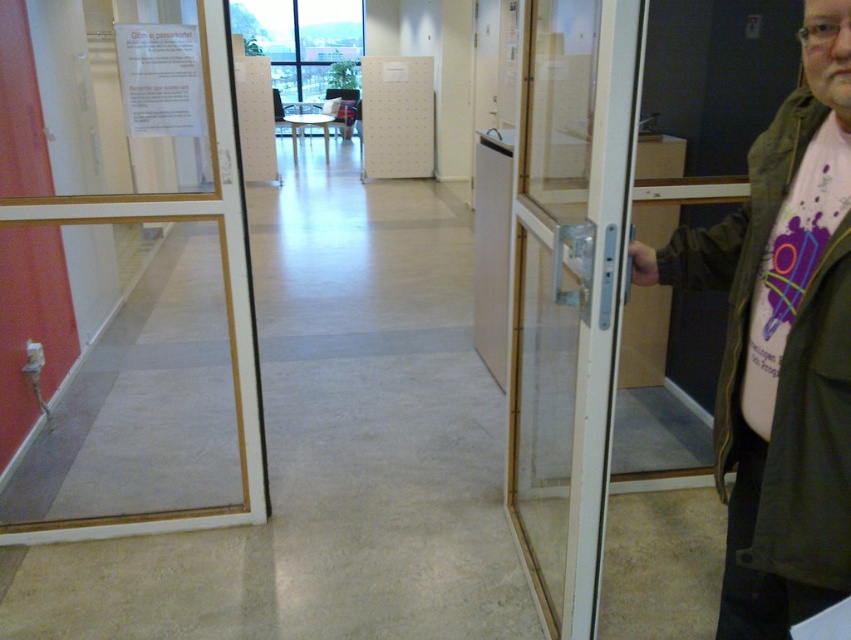
Question: Is green matte jacket at right above clear glass door at left?

Choices:
 (A) no
 (B) yes

Answer: (A)

Question: Is transparent glass door at right to the right of green matte jacket at right from the viewer's perspective?

Choices:
 (A) no
 (B) yes

Answer: (A)

Question: Does transparent glass door at right appear over clear glass door at left?

Choices:
 (A) no
 (B) yes

Answer: (B)

Question: Considering the real-world distances, which object is farthest from the transparent glass door at right?

Choices:
 (A) clear glass door at left
 (B) green matte jacket at right

Answer: (A)

Question: Which is nearer to the transparent glass door at right?

Choices:
 (A) clear glass door at left
 (B) green matte jacket at right

Answer: (B)

Question: Which point is farther to the camera?

Choices:
 (A) (780, 147)
 (B) (540, 442)

Answer: (B)